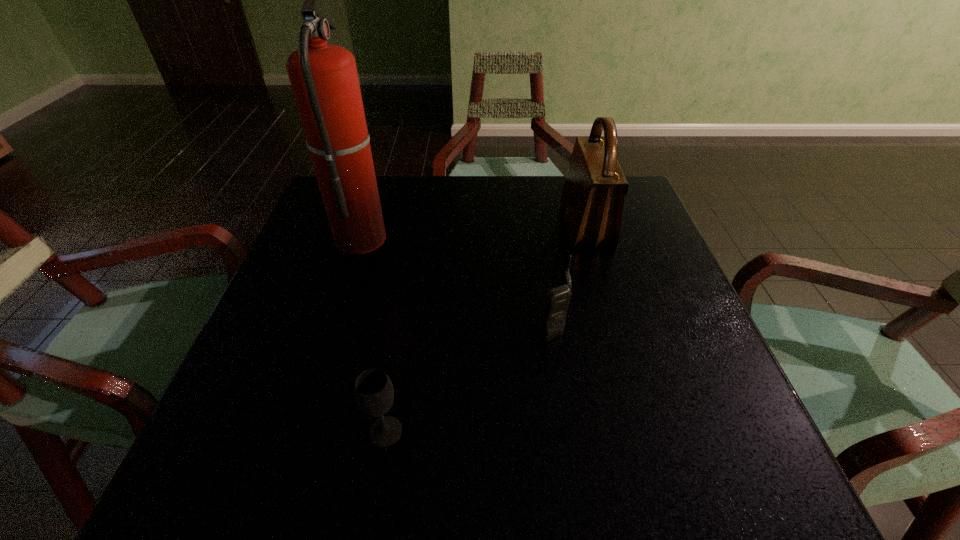
Find the location of `free space that is in between the tallest object and the shoulder bag`. free space that is in between the tallest object and the shoulder bag is located at coordinates (473, 231).

Where is `empty location between the fire extinguisher and the third object from right to left`? The image size is (960, 540). empty location between the fire extinguisher and the third object from right to left is located at coordinates (373, 334).

Find the location of `free point between the tallest object and the cellular telephone`. free point between the tallest object and the cellular telephone is located at coordinates (456, 282).

Locate an element on the screen. free space that is in between the cellular telephone and the third object from right to left is located at coordinates (468, 380).

Identify the location of free spot between the tallest object and the wineglass. The width and height of the screenshot is (960, 540). (373, 334).

The width and height of the screenshot is (960, 540). Identify the location of free spot between the second object from left to right and the tallest object. (373, 334).

The image size is (960, 540). What are the coordinates of `empty space that is in between the fire extinguisher and the second object from left to right` in the screenshot? It's located at (373, 334).

You are a GUI agent. You are given a task and a screenshot of the screen. Output one action in this format:
    pyautogui.click(x=<x>, y=<y>)
    Task: Click on the vacant area between the shoulder bag and the fire extinguisher
    This screenshot has width=960, height=540.
    Given the screenshot: What is the action you would take?
    pyautogui.click(x=473, y=231)

At what (x,y) coordinates should I click in order to perform the action: click on empty location between the second tallest object and the wineglass. Please return your answer as a coordinate pair (x, y). Image resolution: width=960 pixels, height=540 pixels. Looking at the image, I should click on (486, 329).

Locate which object is the second closest to the cellular telephone. Please provide its 2D coordinates. Your answer should be formatted as a tuple, i.e. [(x, y)], where the tuple contains the x and y coordinates of a point satisfying the conditions above.

[(373, 390)]